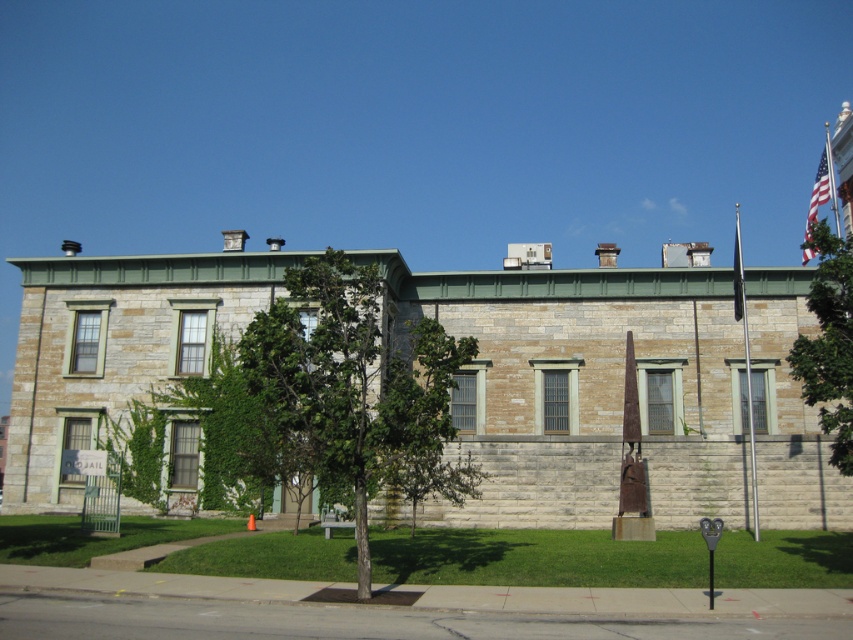
You are standing at the point marked as point (349, 384) in the image. What object is located at this point?

The green leafy tree at center is located at point (349, 384).

From the picture: You are standing on the sidewalk in front of the two story stone building. You see two green leafy trees. Which one has a thicker trunk, the green leafy tree at center or the green leafy tree at upper right?

The green leafy tree at upper right has a thicker trunk than the green leafy tree at center.